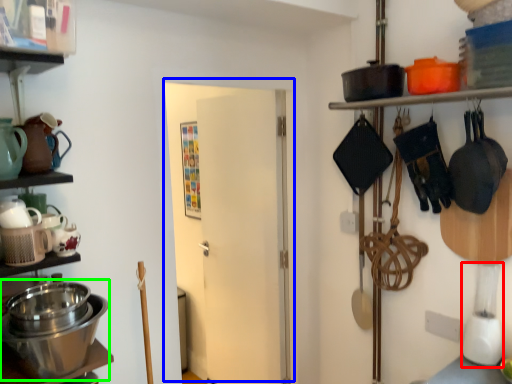
Question: Estimate the real-world distances between objects in this image. Which object is farther from blender (highlighted by a red box), door (highlighted by a blue box) or appliance (highlighted by a green box)?

Choices:
 (A) door
 (B) appliance

Answer: (A)